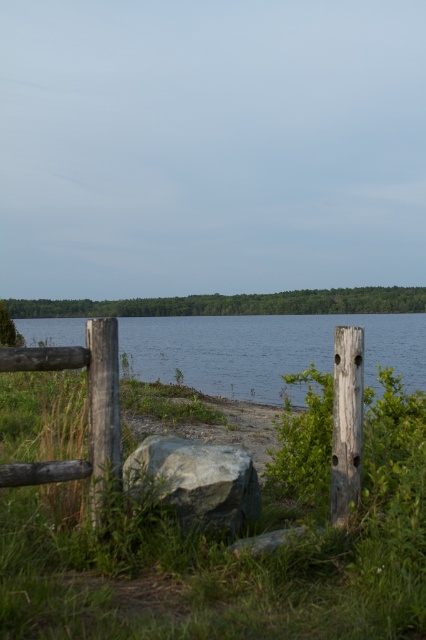
Question: Is clear water at center to the left of weathered wood fence at center from the viewer's perspective?

Choices:
 (A) no
 (B) yes

Answer: (B)

Question: Which of the following is the farthest from the observer?

Choices:
 (A) (x=195, y=518)
 (B) (x=86, y=465)
 (C) (x=385, y=342)

Answer: (C)

Question: Considering the real-world distances, which object is farthest from the gray rough rock at center?

Choices:
 (A) weathered wood fence at center
 (B) clear water at center

Answer: (B)

Question: From the image, what is the correct spatial relationship of weathered wood fence at center in relation to gray rough rock at center?

Choices:
 (A) left
 (B) right

Answer: (A)

Question: Does clear water at center appear on the right side of gray rough rock at center?

Choices:
 (A) yes
 (B) no

Answer: (B)

Question: Which object is the closest to the clear water at center?

Choices:
 (A) weathered wood fence at center
 (B) gray rough rock at center

Answer: (B)